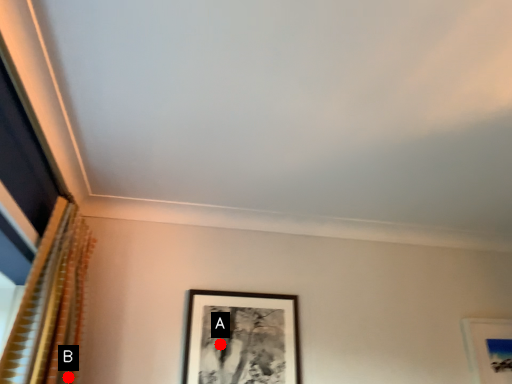
Question: Two points are circled on the image, labeled by A and B beside each circle. Which point is farther to the camera?

Choices:
 (A) A is further
 (B) B is further

Answer: (A)